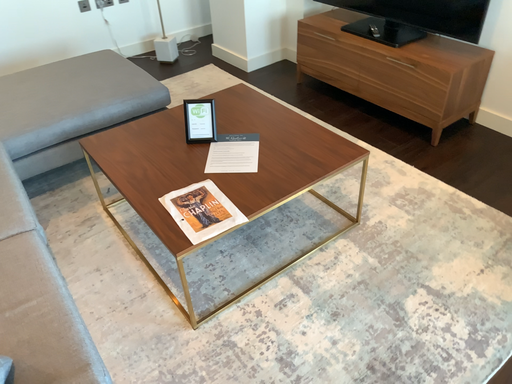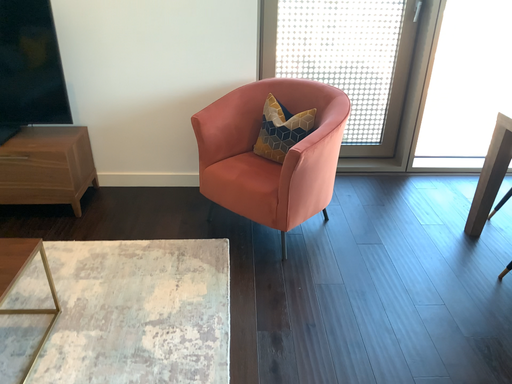
Question: How did the camera likely rotate when shooting the video?

Choices:
 (A) rotated upward
 (B) rotated downward

Answer: (A)